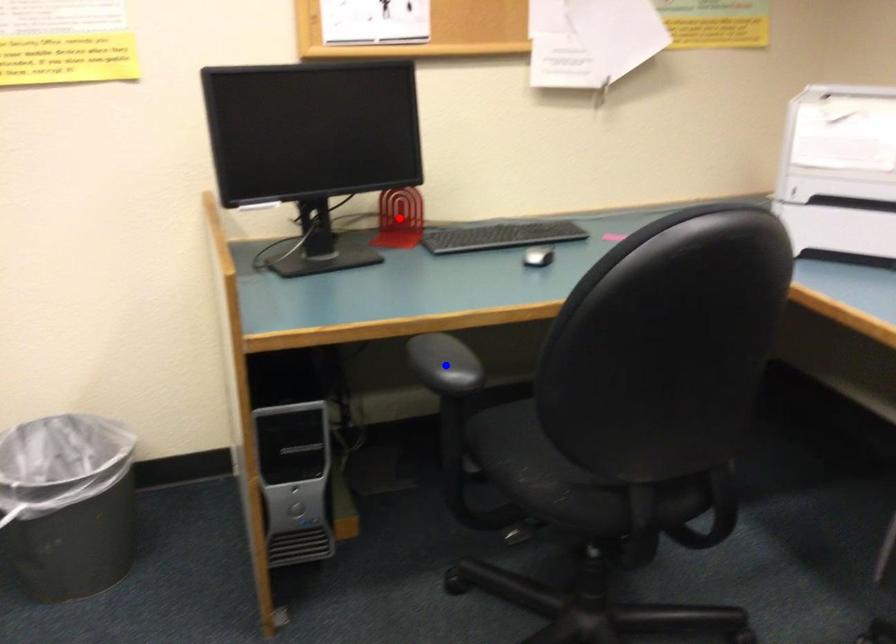
Question: Two points are marked on the image. Which point is closer to the camera?

Choices:
 (A) Blue point is closer.
 (B) Red point is closer.

Answer: (A)